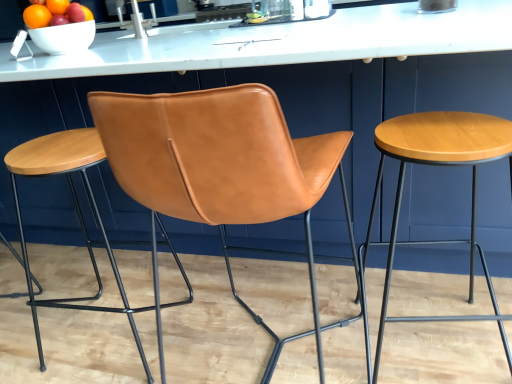
Describe the element at coordinates (439, 165) in the screenshot. The width and height of the screenshot is (512, 384). I see `wooden stool at right, arranged as the 2th stool when viewed from the left` at that location.

Describe the element at coordinates (64, 37) in the screenshot. I see `white glossy bowl at upper left` at that location.

This screenshot has width=512, height=384. I want to click on cognac leather chair at center, so click(x=222, y=167).

What do you see at coordinates (55, 14) in the screenshot? I see `shiny ceramic bowl at upper left` at bounding box center [55, 14].

Find the location of a particular element. saddle brown leather stool at center, which is the 1th stool in left-to-right order is located at coordinates (76, 210).

Considering the points (36, 323) and (42, 48), which point is behind, point (36, 323) or point (42, 48)?

The point (42, 48) is behind.

Based on their sizes in the image, would you say saddle brown leather stool at center, which is the 1th stool in left-to-right order, is bigger or smaller than white glossy bowl at upper left?

Considering their sizes, saddle brown leather stool at center, which is the 1th stool in left-to-right order, takes up more space than white glossy bowl at upper left.

Locate an element on the screen. bowl above the saddle brown leather stool at center, which ranks as the second stool in right-to-left order (from a real-world perspective) is located at coordinates [64, 37].

Considering the relative positions of saddle brown leather stool at center, which is the 1th stool in left-to-right order, and white glossy bowl at upper left in the image provided, is saddle brown leather stool at center, which is the 1th stool in left-to-right order, behind white glossy bowl at upper left?

No, saddle brown leather stool at center, which is the 1th stool in left-to-right order, is closer to the viewer.

Looking at the image, does cognac leather chair at center seem bigger or smaller compared to shiny ceramic bowl at upper left?

In the image, cognac leather chair at center appears to be larger than shiny ceramic bowl at upper left.

You are a GUI agent. You are given a task and a screenshot of the screen. Output one action in this format:
    pyautogui.click(x=<x>, y=<y>)
    Task: Click on the fruit above the cognac leather chair at center (from the image's perspective)
    Image resolution: width=512 pixels, height=384 pixels.
    Given the screenshot: What is the action you would take?
    pyautogui.click(x=55, y=14)

Considering the relative sizes of cognac leather chair at center and shiny ceramic bowl at upper left in the image provided, is cognac leather chair at center shorter than shiny ceramic bowl at upper left?

No.

Is shiny ceramic bowl at upper left closer to the viewer compared to cognac leather chair at center?

No, the depth of shiny ceramic bowl at upper left is greater than that of cognac leather chair at center.

Find the location of a particular element. fruit above the cognac leather chair at center (from the image's perspective) is located at coordinates pos(55,14).

Does shiny ceramic bowl at upper left have a smaller size compared to cognac leather chair at center?

Indeed, shiny ceramic bowl at upper left has a smaller size compared to cognac leather chair at center.

Which is behind, point (70, 3) or point (149, 184)?

Point (70, 3)

Considering the positions of points (501, 322) and (40, 24), is point (501, 322) closer to camera compared to point (40, 24)?

Yes, point (501, 322) is in front of point (40, 24).

From the image's perspective, which one is positioned lower, wooden stool at right, the 1th stool from the right, or shiny ceramic bowl at upper left?

wooden stool at right, the 1th stool from the right, from the image's perspective.

Are wooden stool at right, arranged as the 2th stool when viewed from the left, and shiny ceramic bowl at upper left far apart?

Absolutely, wooden stool at right, arranged as the 2th stool when viewed from the left, is distant from shiny ceramic bowl at upper left.

Is shiny ceramic bowl at upper left a part of wooden stool at right, the 1th stool from the right?

No, shiny ceramic bowl at upper left is located outside of wooden stool at right, the 1th stool from the right.

In terms of height, does wooden stool at right, arranged as the 2th stool when viewed from the left, look taller or shorter compared to saddle brown leather stool at center, which is the 1th stool in left-to-right order?

Considering their sizes, wooden stool at right, arranged as the 2th stool when viewed from the left, has less height than saddle brown leather stool at center, which is the 1th stool in left-to-right order.

Does wooden stool at right, arranged as the 2th stool when viewed from the left, have a lesser width compared to saddle brown leather stool at center, which ranks as the second stool in right-to-left order?

Correct, the width of wooden stool at right, arranged as the 2th stool when viewed from the left, is less than that of saddle brown leather stool at center, which ranks as the second stool in right-to-left order.

From the image's perspective, is wooden stool at right, the 1th stool from the right, on saddle brown leather stool at center, which is the 1th stool in left-to-right order?

No.

How many degrees apart are the facing directions of wooden stool at right, the 1th stool from the right, and cognac leather chair at center?

There is a 6.76-degree angle between the facing directions of wooden stool at right, the 1th stool from the right, and cognac leather chair at center.

Which is more to the left, wooden stool at right, the 1th stool from the right, or cognac leather chair at center?

Positioned to the left is cognac leather chair at center.

Is wooden stool at right, arranged as the 2th stool when viewed from the left, completely or partially outside of cognac leather chair at center?

Yes.

Is point (368, 238) positioned after point (295, 335)?

Yes, point (368, 238) is behind point (295, 335).

Which object is further away from the camera, white glossy bowl at upper left or wooden stool at right, arranged as the 2th stool when viewed from the left?

white glossy bowl at upper left.

From a real-world perspective, which object stands above the other?

white glossy bowl at upper left.

Is white glossy bowl at upper left shorter than wooden stool at right, arranged as the 2th stool when viewed from the left?

Yes.

Which is closer to the camera, [81,39] or [473,273]?

The point [81,39] is closer.

This screenshot has height=384, width=512. I want to click on the 1st stool positioned below the white glossy bowl at upper left (from a real-world perspective), so click(x=76, y=210).

This screenshot has width=512, height=384. What are the coordinates of `chair on the right of shiny ceramic bowl at upper left` in the screenshot? It's located at (222, 167).

Based on their spatial positions, is saddle brown leather stool at center, which is the 1th stool in left-to-right order, or white glossy bowl at upper left closer to shiny ceramic bowl at upper left?

white glossy bowl at upper left.

Considering their positions, is white glossy bowl at upper left positioned closer to saddle brown leather stool at center, which ranks as the second stool in right-to-left order, than shiny ceramic bowl at upper left?

white glossy bowl at upper left is positioned closer to the anchor saddle brown leather stool at center, which ranks as the second stool in right-to-left order.

When comparing their distances from cognac leather chair at center, does wooden stool at right, the 1th stool from the right, or saddle brown leather stool at center, which is the 1th stool in left-to-right order, seem further?

saddle brown leather stool at center, which is the 1th stool in left-to-right order.

Consider the image. Based on their spatial positions, is white glossy bowl at upper left or saddle brown leather stool at center, which is the 1th stool in left-to-right order, further from shiny ceramic bowl at upper left?

saddle brown leather stool at center, which is the 1th stool in left-to-right order, is positioned further to the anchor shiny ceramic bowl at upper left.

Based on their spatial positions, is saddle brown leather stool at center, which is the 1th stool in left-to-right order, or wooden stool at right, the 1th stool from the right, closer to shiny ceramic bowl at upper left?

saddle brown leather stool at center, which is the 1th stool in left-to-right order.

Which object lies nearer to the anchor point wooden stool at right, the 1th stool from the right, cognac leather chair at center or white glossy bowl at upper left?

Based on the image, cognac leather chair at center appears to be nearer to wooden stool at right, the 1th stool from the right.

Estimate the real-world distances between objects in this image. Which object is closer to wooden stool at right, the 1th stool from the right, shiny ceramic bowl at upper left or saddle brown leather stool at center, which is the 1th stool in left-to-right order?

saddle brown leather stool at center, which is the 1th stool in left-to-right order.

Estimate the real-world distances between objects in this image. Which object is further from white glossy bowl at upper left, cognac leather chair at center or shiny ceramic bowl at upper left?

shiny ceramic bowl at upper left.

Where is `bowl between shiny ceramic bowl at upper left and wooden stool at right, arranged as the 2th stool when viewed from the left, from left to right`? This screenshot has width=512, height=384. bowl between shiny ceramic bowl at upper left and wooden stool at right, arranged as the 2th stool when viewed from the left, from left to right is located at coordinates (64, 37).

What are the coordinates of `chair between shiny ceramic bowl at upper left and wooden stool at right, the 1th stool from the right` in the screenshot? It's located at (222, 167).

I want to click on stool between shiny ceramic bowl at upper left and wooden stool at right, arranged as the 2th stool when viewed from the left, so click(x=76, y=210).

Find the location of `stool located between white glossy bowl at upper left and wooden stool at right, the 1th stool from the right, in the left-right direction`. stool located between white glossy bowl at upper left and wooden stool at right, the 1th stool from the right, in the left-right direction is located at coordinates (76, 210).